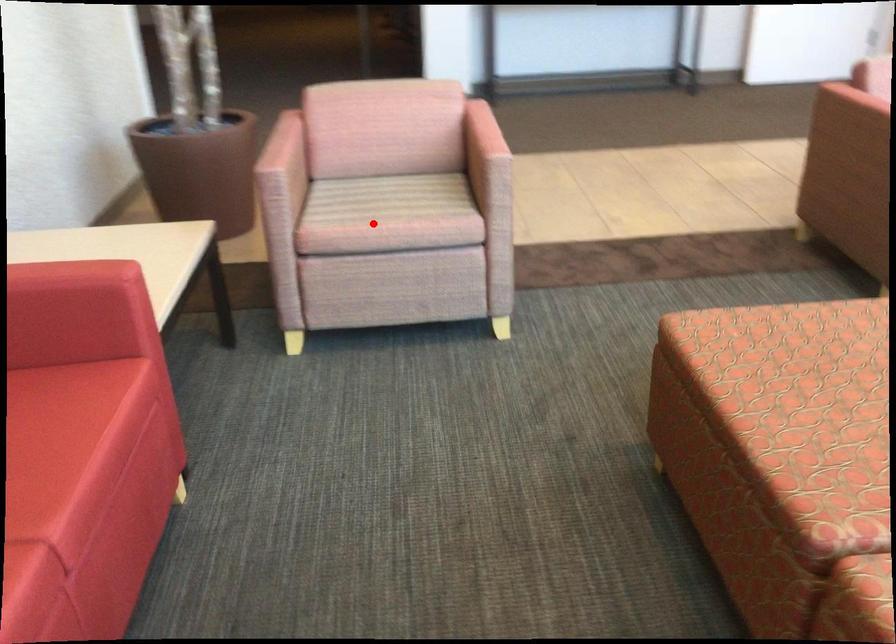
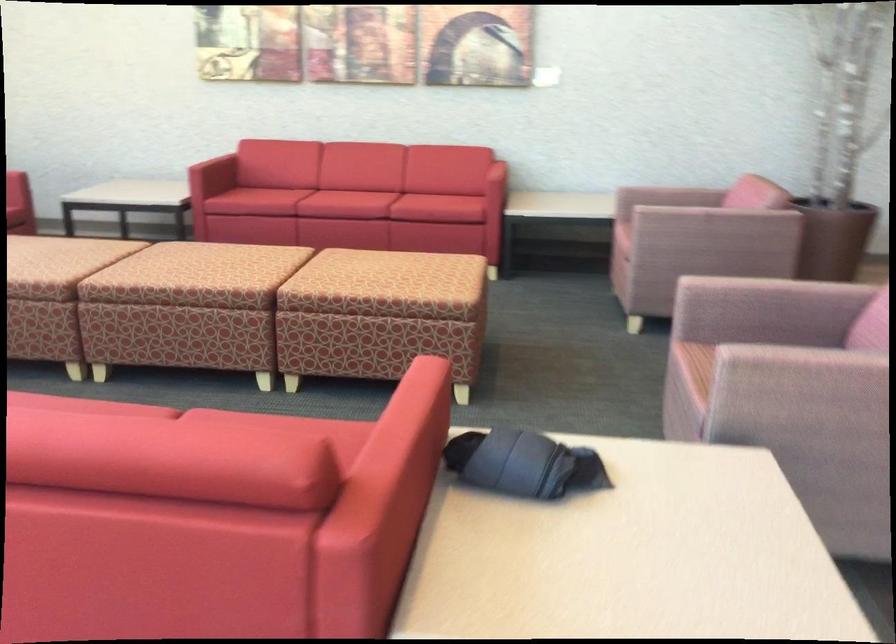
Question: I am providing you with two images of the same scene from different viewpoints. In image1, a red point is highlighted. Considering the same 3D point in image2, which of the following is correct?

Choices:
 (A) It is closer
 (B) It is farther

Answer: (B)